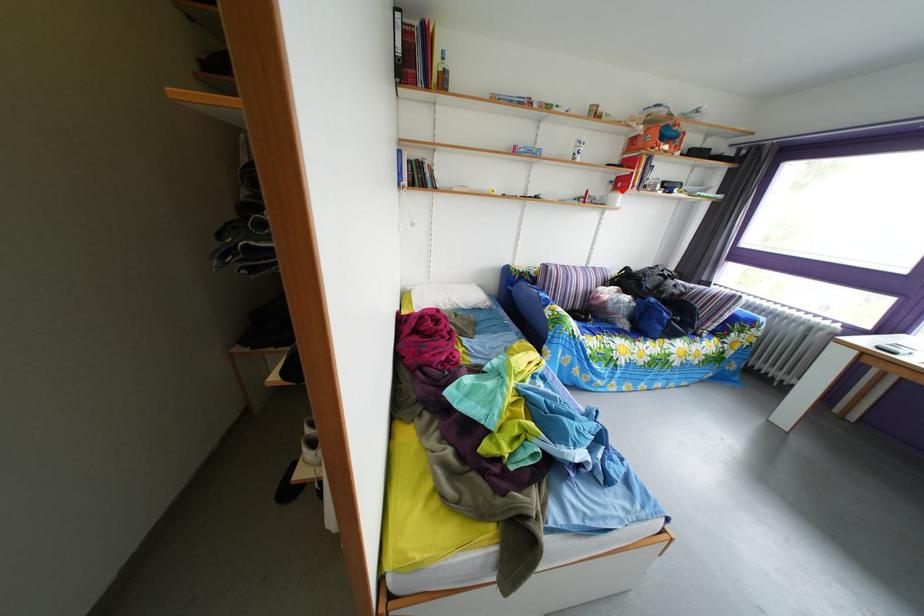
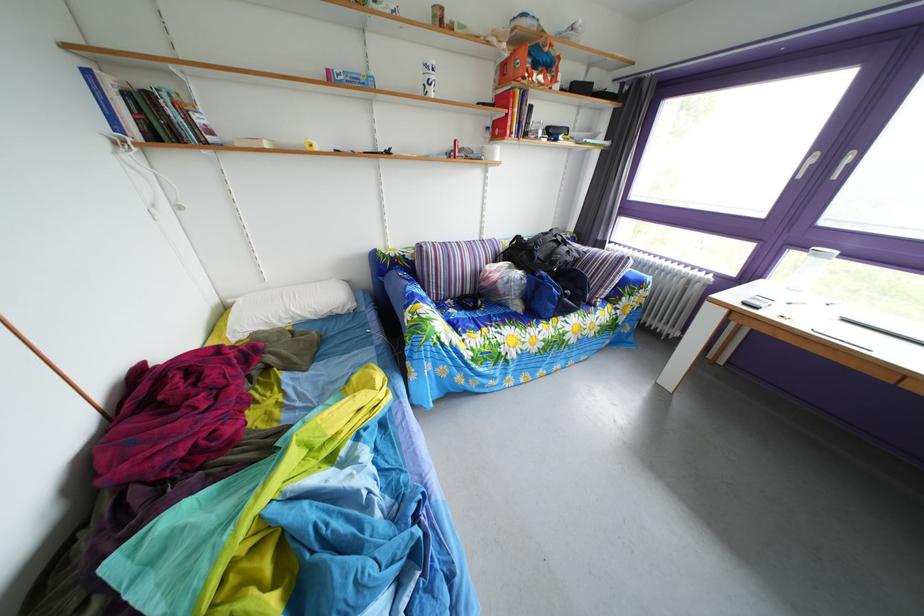
The point at the highlighted location is marked in the first image. Where is the corresponding point in the second image?

(499, 137)